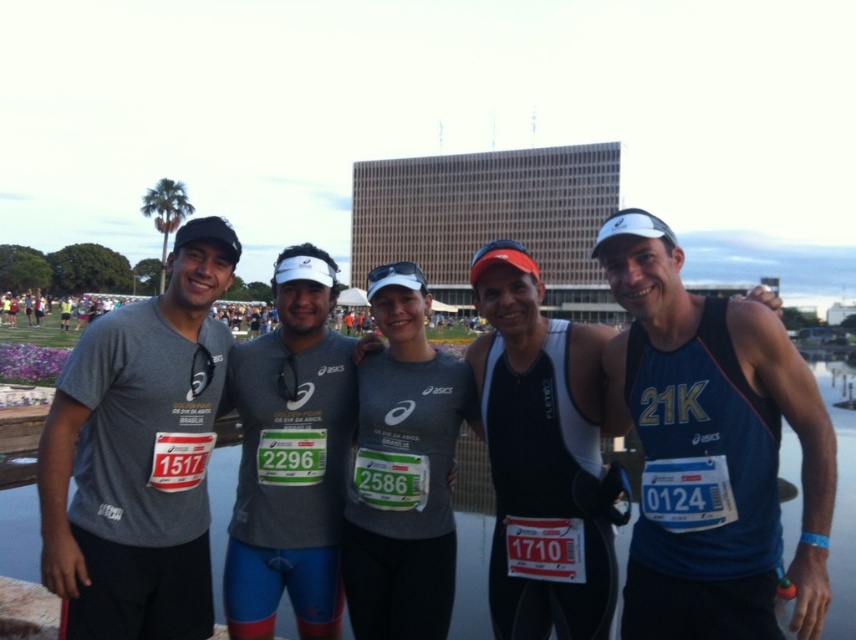
Question: Can you confirm if blue fabric tank top at center is wider than matte gray t-shirt at left?

Choices:
 (A) no
 (B) yes

Answer: (A)

Question: Which object is positioned closest to the matte gray shirt at center?

Choices:
 (A) gray fabric shirt at center
 (B) blue fabric tank top at center
 (C) matte gray t-shirt at left
 (D) transparent water at center

Answer: (A)

Question: In this image, where is matte gray t-shirt at left located relative to transparent water at center?

Choices:
 (A) below
 (B) above

Answer: (B)

Question: Is blue fabric tank top at center smaller than matte gray t-shirt at left?

Choices:
 (A) yes
 (B) no

Answer: (A)

Question: Among these points, which one is farthest from the camera?

Choices:
 (A) (375, 552)
 (B) (103, 544)

Answer: (A)

Question: Which object is the closest to the gray fabric shirt at center?

Choices:
 (A) matte gray t-shirt at left
 (B) blue fabric tank top at center
 (C) black matte tank top at center

Answer: (A)